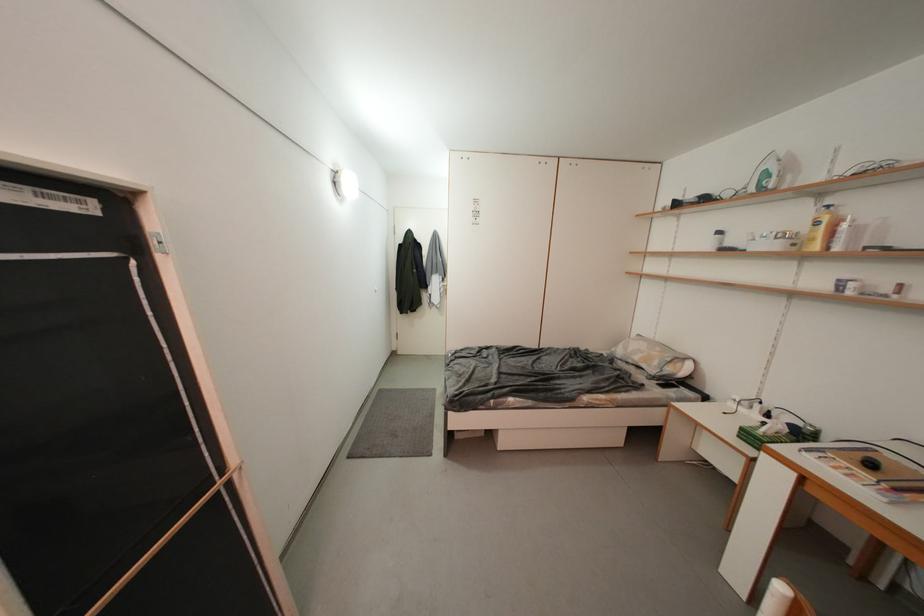
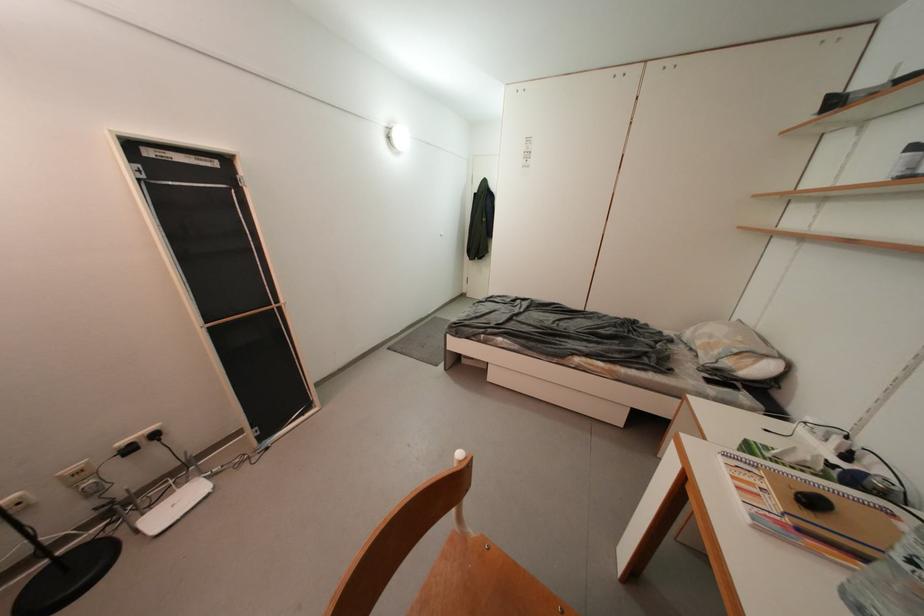
Question: How did the camera likely rotate?

Choices:
 (A) Left
 (B) Right
 (C) Up
 (D) Down

Answer: (A)